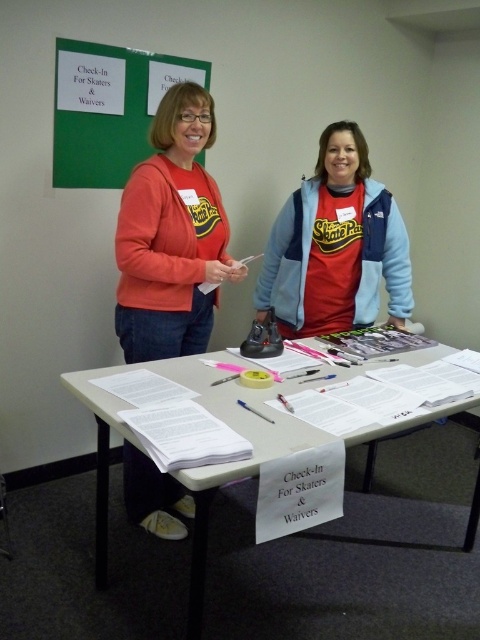
Question: Which point is farther to the camera?

Choices:
 (A) matte red sweatshirt at center
 (B) matte orange sweater at left
 (C) green matte board at upper left

Answer: (A)

Question: Among these points, which one is farthest from the camera?

Choices:
 (A) (120, 298)
 (B) (290, 205)

Answer: (B)

Question: Is the position of green matte board at upper left less distant than that of matte red sweatshirt at left?

Choices:
 (A) yes
 (B) no

Answer: (B)

Question: Can you confirm if matte orange sweater at left is positioned above green matte board at upper left?

Choices:
 (A) no
 (B) yes

Answer: (A)

Question: Which point is closer to the camera taking this photo?

Choices:
 (A) (72, 372)
 (B) (154, 291)

Answer: (B)

Question: Observing the image, what is the correct spatial positioning of white paper at center in reference to green matte board at upper left?

Choices:
 (A) below
 (B) above

Answer: (A)